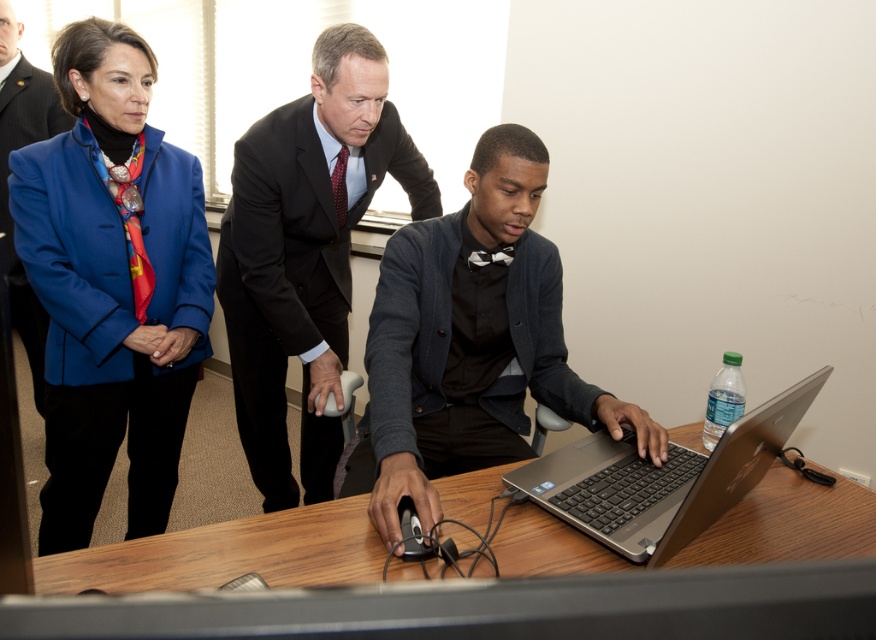
Question: Does blue fabric jacket at upper left have a smaller size compared to silver metallic laptop at center?

Choices:
 (A) no
 (B) yes

Answer: (A)

Question: Observing the image, what is the correct spatial positioning of silver metallic laptop at center in reference to matte blue blazer at upper left?

Choices:
 (A) below
 (B) above

Answer: (A)

Question: Does blue fabric jacket at upper left appear on the right side of matte blue blazer at upper left?

Choices:
 (A) yes
 (B) no

Answer: (A)

Question: Considering the real-world distances, which object is farthest from the dark gray wool blazer at center?

Choices:
 (A) silver metallic laptop at center
 (B) wooden table at center
 (C) matte blue blazer at upper left

Answer: (C)

Question: Which object is positioned farthest from the wooden table at center?

Choices:
 (A) matte blue blazer at upper left
 (B) blue fabric jacket at upper left
 (C) dark gray wool blazer at center

Answer: (A)

Question: Among these points, which one is farthest from the camera?

Choices:
 (A) (427, 317)
 (B) (477, 566)

Answer: (A)